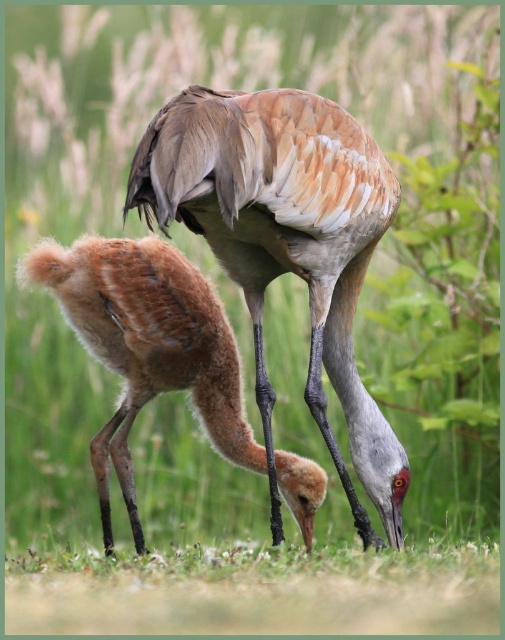
Who is positioned more to the right, brown feathered crane at center or brown fluffy chick at lower left?

From the viewer's perspective, brown feathered crane at center appears more on the right side.

Can you confirm if brown feathered crane at center is taller than brown fluffy chick at lower left?

Correct, brown feathered crane at center is much taller as brown fluffy chick at lower left.

Measure the distance between brown feathered crane at center and camera.

2.81 meters

Locate an element on the screen. This screenshot has width=505, height=640. brown feathered crane at center is located at coordinates (285, 246).